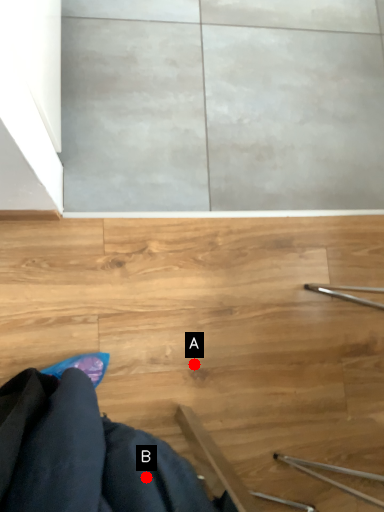
Question: Two points are circled on the image, labeled by A and B beside each circle. Among these points, which one is nearest to the camera?

Choices:
 (A) A is closer
 (B) B is closer

Answer: (B)